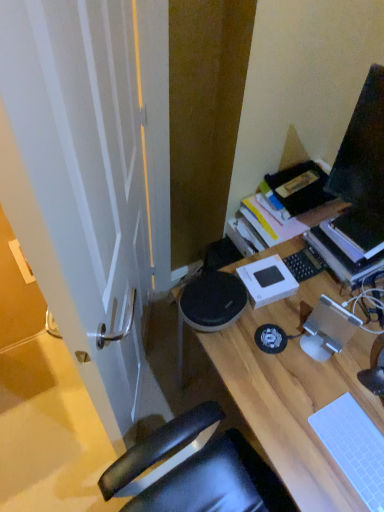
Question: Is white matte laptop keyboard at lower right, which is the first laptop keyboard in front-to-back order, outside of hardcover book at upper right?

Choices:
 (A) yes
 (B) no

Answer: (A)

Question: From the image's perspective, is white matte laptop keyboard at lower right, placed as the second laptop keyboard when sorted from top to bottom, on hardcover book at upper right?

Choices:
 (A) no
 (B) yes

Answer: (A)

Question: From the image's perspective, is white matte laptop keyboard at lower right, the second laptop keyboard when ordered from back to front, below hardcover book at upper right?

Choices:
 (A) yes
 (B) no

Answer: (A)

Question: Is white matte laptop keyboard at lower right, the first laptop keyboard ordered from the bottom, turned away from hardcover book at upper right?

Choices:
 (A) no
 (B) yes

Answer: (A)

Question: Can you confirm if white matte laptop keyboard at lower right, the second laptop keyboard when ordered from back to front, is thinner than hardcover book at upper right?

Choices:
 (A) yes
 (B) no

Answer: (A)

Question: From a real-world perspective, is white matte laptop keyboard at lower right, which is the first laptop keyboard in front-to-back order, positioned above or below hardcover book at upper right?

Choices:
 (A) above
 (B) below

Answer: (B)

Question: Considering the positions of point (357, 490) and point (327, 237), is point (357, 490) closer or farther from the camera than point (327, 237)?

Choices:
 (A) closer
 (B) farther

Answer: (A)

Question: From the image's perspective, relative to hardcover book at upper right, is white matte laptop keyboard at lower right, the first laptop keyboard ordered from the bottom, above or below?

Choices:
 (A) below
 (B) above

Answer: (A)

Question: Is white matte laptop keyboard at lower right, placed as the second laptop keyboard when sorted from top to bottom, wider or thinner than hardcover book at upper right?

Choices:
 (A) thin
 (B) wide

Answer: (A)

Question: In the image, is hardcover book at upper right on the left side or the right side of white matte laptop keyboard at lower right, placed as the second laptop keyboard when sorted from top to bottom?

Choices:
 (A) left
 (B) right

Answer: (B)

Question: From a real-world perspective, is hardcover book at upper right positioned above or below white matte laptop keyboard at lower right, the first laptop keyboard ordered from the bottom?

Choices:
 (A) below
 (B) above

Answer: (B)

Question: From the image's perspective, is hardcover book at upper right located above or below white matte laptop keyboard at lower right, the second laptop keyboard when ordered from back to front?

Choices:
 (A) below
 (B) above

Answer: (B)

Question: Relative to white matte laptop keyboard at lower right, placed as the second laptop keyboard when sorted from top to bottom, is hardcover book at upper right in front or behind?

Choices:
 (A) front
 (B) behind

Answer: (B)

Question: Considering their positions, is white matte laptop keyboard at lower right, placed as the second laptop keyboard when sorted from top to bottom, located in front of or behind wooden desk at center?

Choices:
 (A) behind
 (B) front

Answer: (A)

Question: Based on their positions, is white matte laptop keyboard at lower right, placed as the second laptop keyboard when sorted from top to bottom, located to the left or right of wooden desk at center?

Choices:
 (A) left
 (B) right

Answer: (A)